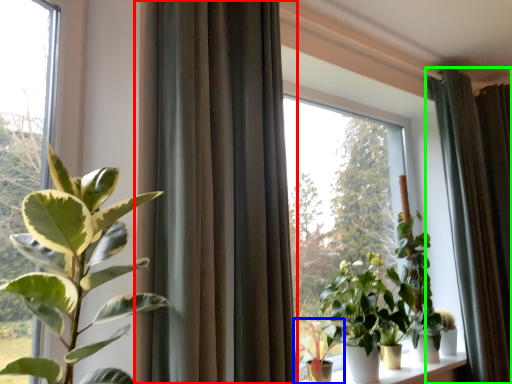
Question: Considering the real-world distances, which object is closest to curtain (highlighted by a red box)? houseplant (highlighted by a blue box) or curtain (highlighted by a green box).

Choices:
 (A) houseplant
 (B) curtain

Answer: (A)